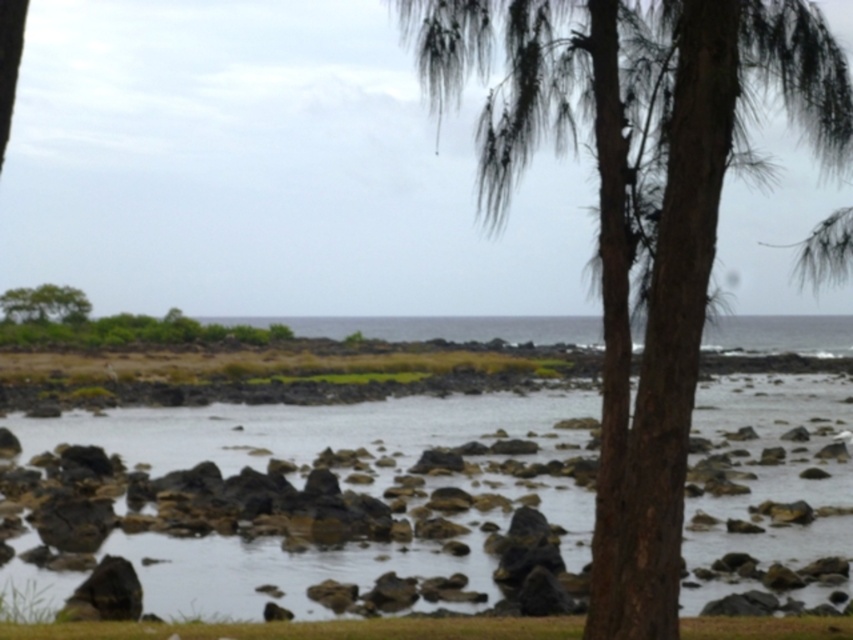
You are standing at the shoreline looking out towards the horizon. You see the clear water at center and the green leafy tree at upper left. Which object occupies a wider area in the scene?

The clear water at center occupies a wider area than the green leafy tree at upper left because its width surpasses the tree.

You are standing on the rocky shoreline and want to cross to the other side. You see the clear water at center and the brown rough bark palm tree at right. Which path would allow you to cross the water safely?

The clear water at center is wider than the brown rough bark palm tree at right, so it would be safer to cross through the clear water at center since it provides a broader path.

You are standing on the rocky shoreline and want to walk towards the clear water at center. However, there is a brown rough bark palm tree at right in your path. Which direction should you move to avoid the tree and reach the water?

You should move to the left to avoid the brown rough bark palm tree at right and reach the clear water at center since the tree is on the right side of the path and the water is further ahead.